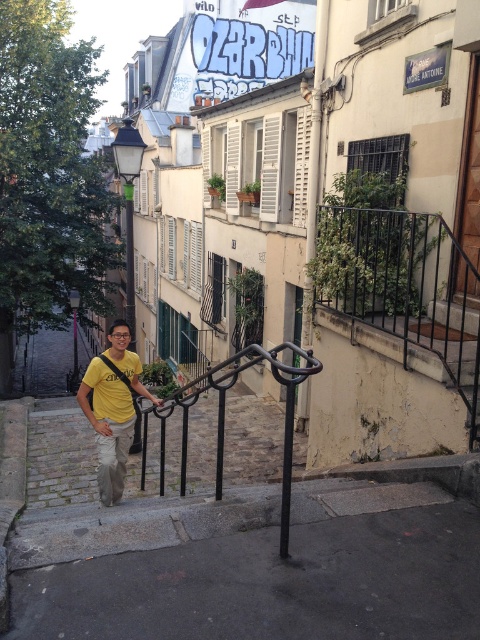
Is black metal/rail at right smaller than yellow matte shirt at center?

Actually, black metal/rail at right might be larger than yellow matte shirt at center.

Which is above, black metal/rail at right or yellow matte shirt at center?

Positioned higher is black metal/rail at right.

Who is more distant from viewer, [430,337] or [116,496]?

The point [116,496] is more distant.

What are the coordinates of `black metal/rail at right` in the screenshot? It's located at 404,288.

Is black metal/rail at right shorter than yellow matte polo shirt at lower left?

No.

Is black metal/rail at right further to camera compared to yellow matte polo shirt at lower left?

No, black metal/rail at right is in front of yellow matte polo shirt at lower left.

Does point (479, 362) lie in front of point (123, 384)?

Yes, it is.

Where is `black metal/rail at right`? The image size is (480, 640). black metal/rail at right is located at coordinates (404, 288).

Does point (276, 360) come in front of point (99, 387)?

Yes, it is.

Between black metal rail at center and yellow matte shirt at center, which one appears on the left side from the viewer's perspective?

yellow matte shirt at center is more to the left.

Does point (223, 412) lie behind point (111, 384)?

No, (223, 412) is in front of (111, 384).

This screenshot has width=480, height=640. I want to click on black metal rail at center, so (224, 417).